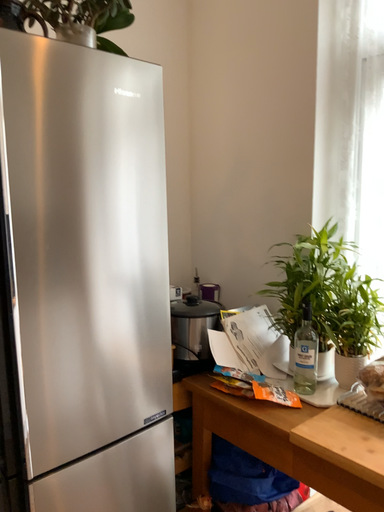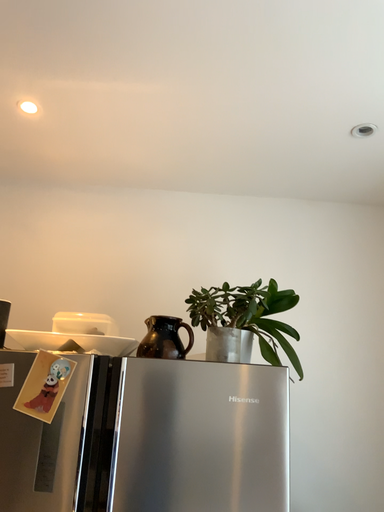
Question: How did the camera likely rotate when shooting the video?

Choices:
 (A) rotated downward
 (B) rotated upward

Answer: (B)